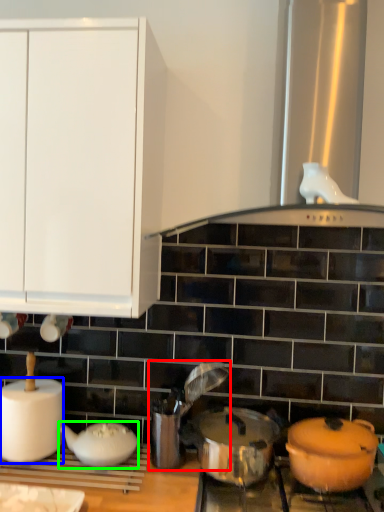
Question: Estimate the real-world distances between objects in this image. Which object is closer to appliance (highlighted by a red box), paper towel (highlighted by a blue box) or tableware (highlighted by a green box)?

Choices:
 (A) paper towel
 (B) tableware

Answer: (B)